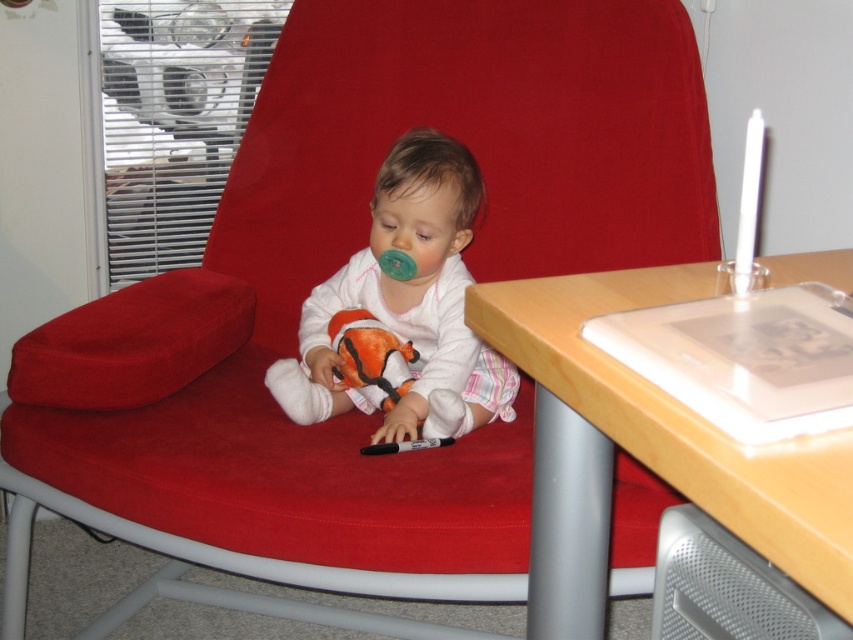
Who is more distant from viewer, (567, 353) or (392, 221)?

Positioned behind is point (392, 221).

Between wooden table at lower right and white soft baby at center, which one appears on the left side from the viewer's perspective?

white soft baby at center is more to the left.

Which is in front, point (595, 636) or point (393, 374)?

Point (595, 636) is in front.

I want to click on wooden table at lower right, so click(648, 449).